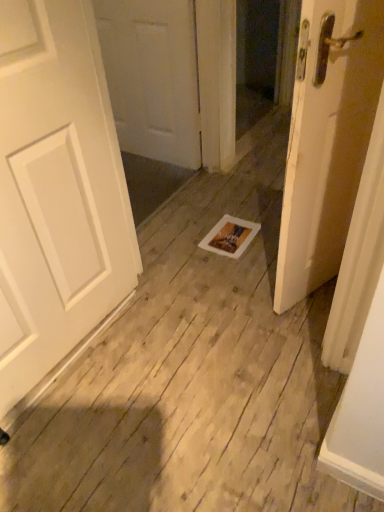
Describe the element at coordinates (152, 77) in the screenshot. The height and width of the screenshot is (512, 384). I see `white matte door at center` at that location.

This screenshot has height=512, width=384. Identify the location of white matte door at center. pos(152,77).

The height and width of the screenshot is (512, 384). In order to click on white matte door at center in this screenshot , I will do `click(152, 77)`.